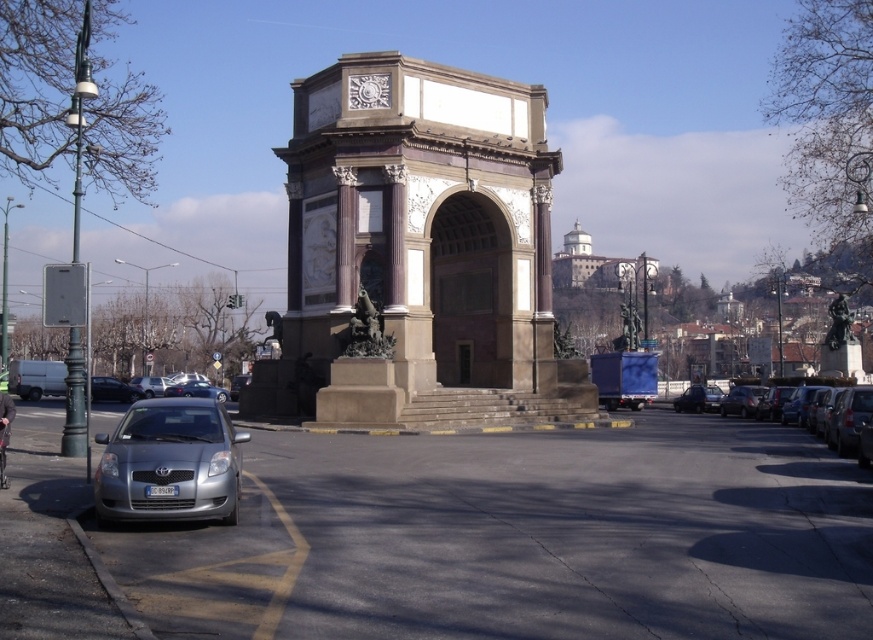
You are standing in the public square and want to take a photo of the brown stone arch at center. Where should you position yourself to ensure the arch is centered in your camera frame?

The brown stone arch at center is located at point coordinates (x=418, y=252), so you should position yourself directly in front of the coordinates to center it in your camera frame.

You are standing at the center of the monument and want to locate the silver metallic car at lower left. In which direction should you look to see it?

You should look to the lower left direction to see the silver metallic car at lower left, as its 2D location is at point [169,464].

You are a photographer planning to capture the monument from the square. You have a silver metallic car at lower left and a bronze statue at center in your shot. Which object appears narrower in the photo?

The silver metallic car at lower left appears narrower than the bronze statue at center in the photo.